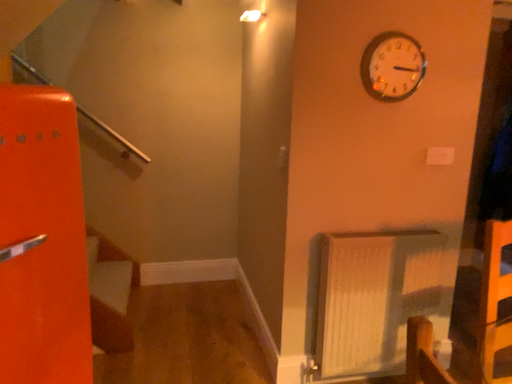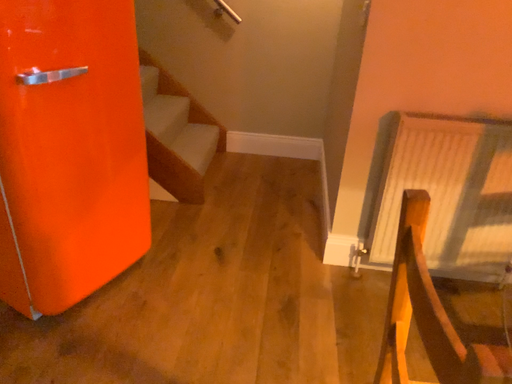
Question: How did the camera likely rotate when shooting the video?

Choices:
 (A) rotated upward
 (B) rotated downward

Answer: (B)